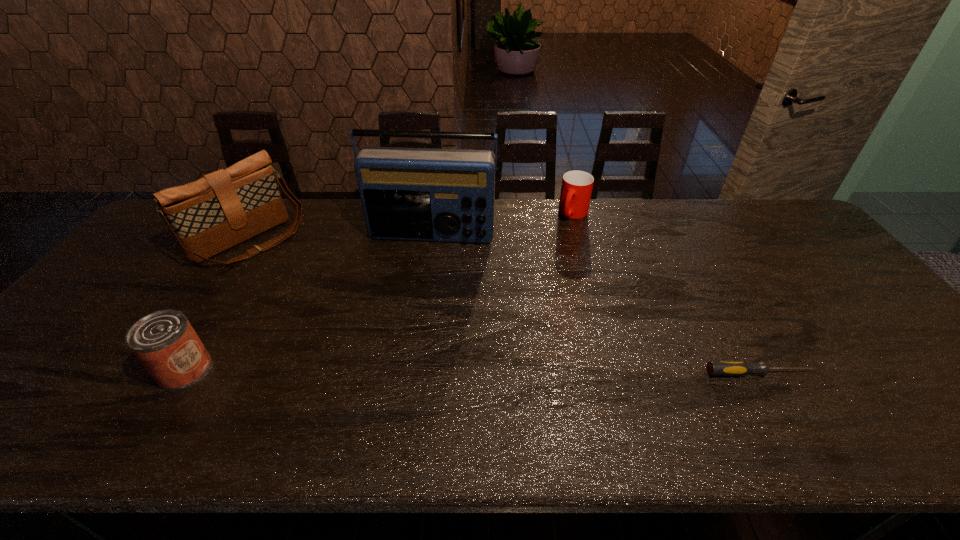
Image resolution: width=960 pixels, height=540 pixels. In order to click on can in this screenshot , I will do `click(164, 341)`.

This screenshot has width=960, height=540. I want to click on the shortest object, so click(715, 368).

Locate an element on the screen. screwdriver is located at coordinates (715, 368).

Identify the location of the tallest object. (444, 195).

What are the coordinates of `radio receiver` in the screenshot? It's located at (444, 195).

Image resolution: width=960 pixels, height=540 pixels. I want to click on cup, so click(x=576, y=189).

At what (x,y) coordinates should I click in order to perform the action: click on the fourth shortest object. Please return your answer as a coordinate pair (x, y). The width and height of the screenshot is (960, 540). Looking at the image, I should click on (224, 208).

At what (x,y) coordinates should I click in order to perform the action: click on free region located on the back of the can. Please return your answer as a coordinate pair (x, y). The image size is (960, 540). Looking at the image, I should click on (247, 267).

Locate an element on the screen. vacant space situated 0.140m insert the rightmost object into a screw head is located at coordinates (870, 373).

Identify the location of free space located on the front panel of the tallest object. (408, 318).